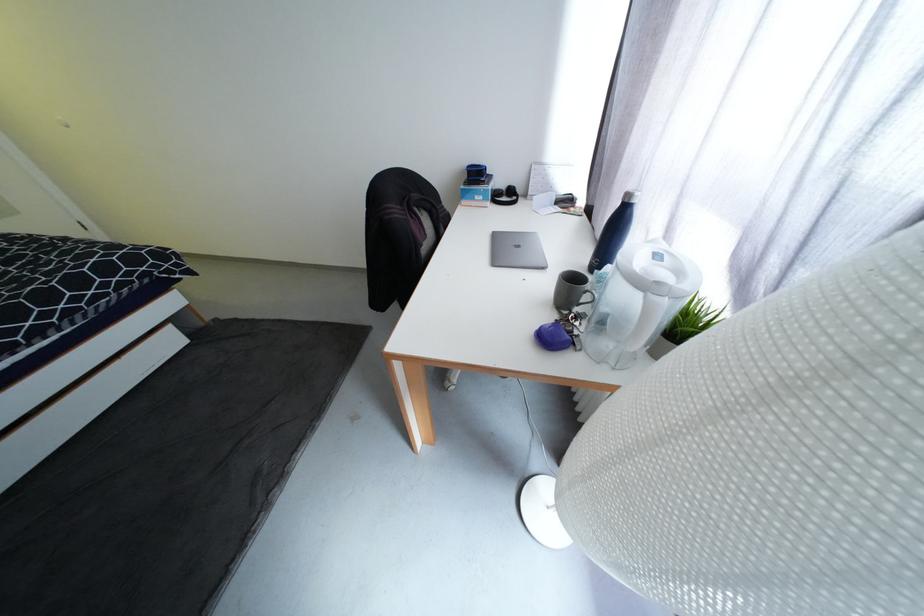
What do you see at coordinates (646, 321) in the screenshot? I see `the pitcher handle` at bounding box center [646, 321].